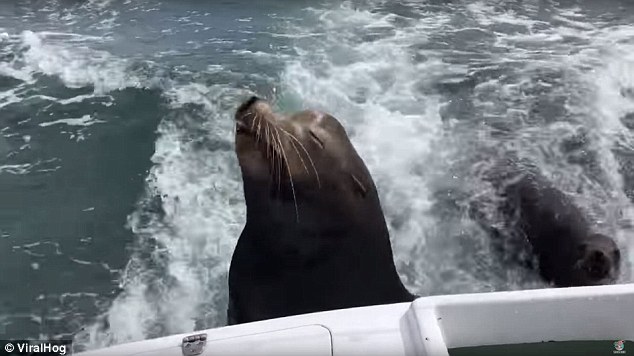
The width and height of the screenshot is (634, 356). Identify the location of metal hinge. (193, 341).